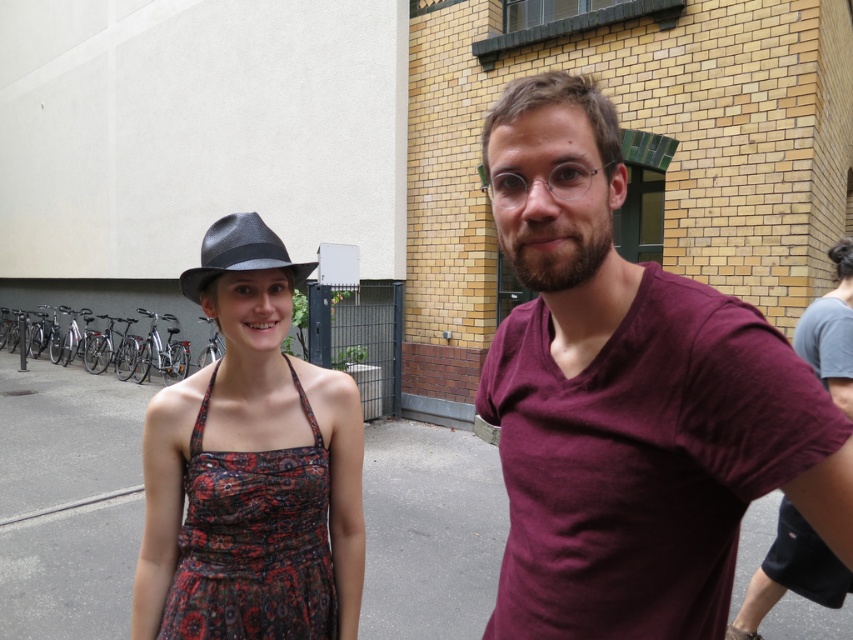
Question: Which point appears farthest from the camera in this image?

Choices:
 (A) (294, 550)
 (B) (262, 268)
 (C) (598, 563)

Answer: (A)

Question: In this image, where is maroon cotton t-shirt at right located relative to printed fabric dress at center?

Choices:
 (A) below
 (B) above

Answer: (B)

Question: Is maroon cotton t-shirt at right to the right of printed fabric dress at center from the viewer's perspective?

Choices:
 (A) no
 (B) yes

Answer: (B)

Question: Which point is farther to the camera?

Choices:
 (A) matte black fedora at center
 (B) printed fabric dress at center

Answer: (B)

Question: Considering the real-world distances, which object is closest to the maroon cotton t-shirt at right?

Choices:
 (A) matte black fedora at center
 (B) printed fabric dress at center

Answer: (B)

Question: Is maroon cotton t-shirt at right in front of matte black fedora at center?

Choices:
 (A) no
 (B) yes

Answer: (B)